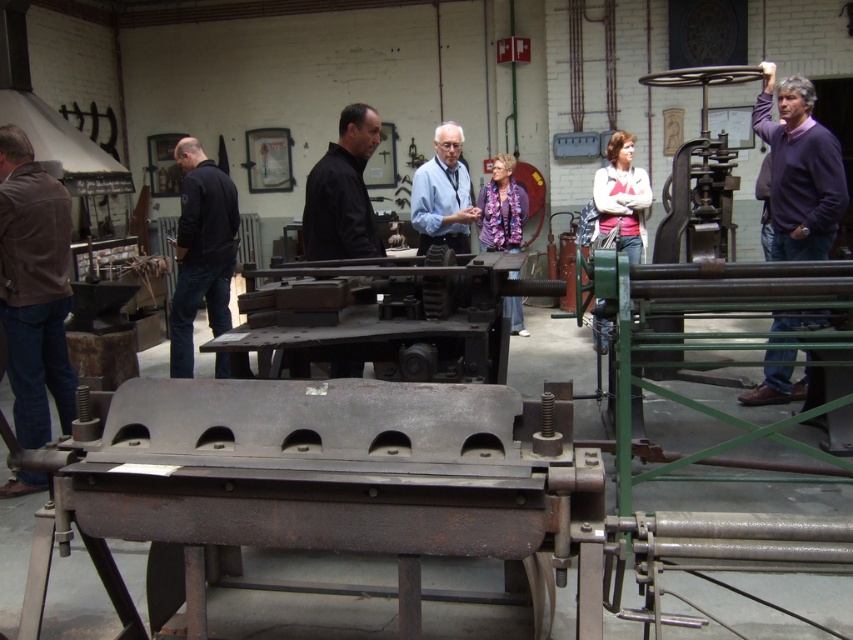
Is brown leather jacket at left smaller than purple floral shirt at center?

Incorrect, brown leather jacket at left is not smaller in size than purple floral shirt at center.

What do you see at coordinates (33, 289) in the screenshot?
I see `brown leather jacket at left` at bounding box center [33, 289].

Between point (13, 301) and point (503, 214), which one is positioned in front?

Point (13, 301)

Image resolution: width=853 pixels, height=640 pixels. Identify the location of brown leather jacket at left. (33, 289).

Which is in front, point (831, 188) or point (350, 188)?

Positioned in front is point (350, 188).

Is purple sweater at right positioned at the back of black matte shirt at center?

Yes, purple sweater at right is behind black matte shirt at center.

Is point (834, 182) behind point (320, 208)?

Yes, point (834, 182) is behind point (320, 208).

At what (x,y) coordinates should I click in order to perform the action: click on purple sweater at right. Please return your answer as a coordinate pair (x, y). This screenshot has height=640, width=853. Looking at the image, I should click on (799, 170).

Can you confirm if rusty metal machinery at center is smaller than black matte shirt at center?

Incorrect, rusty metal machinery at center is not smaller in size than black matte shirt at center.

Consider the image. Which of these two, rusty metal machinery at center or black matte shirt at center, stands shorter?

rusty metal machinery at center is shorter.

Who is more distant from viewer, (498, 308) or (344, 212)?

The point (344, 212) is more distant.

Identify the location of rusty metal machinery at center. This screenshot has height=640, width=853. (387, 316).